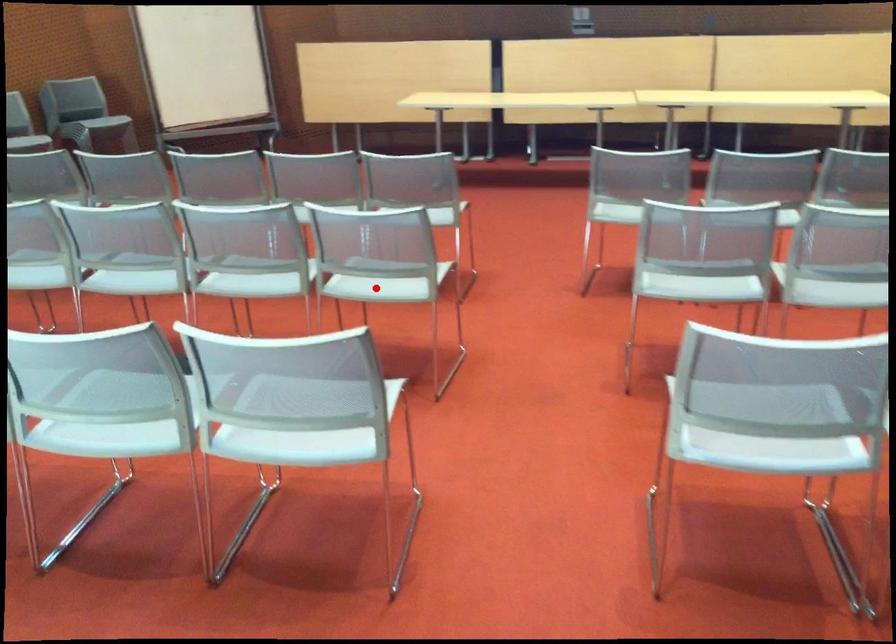
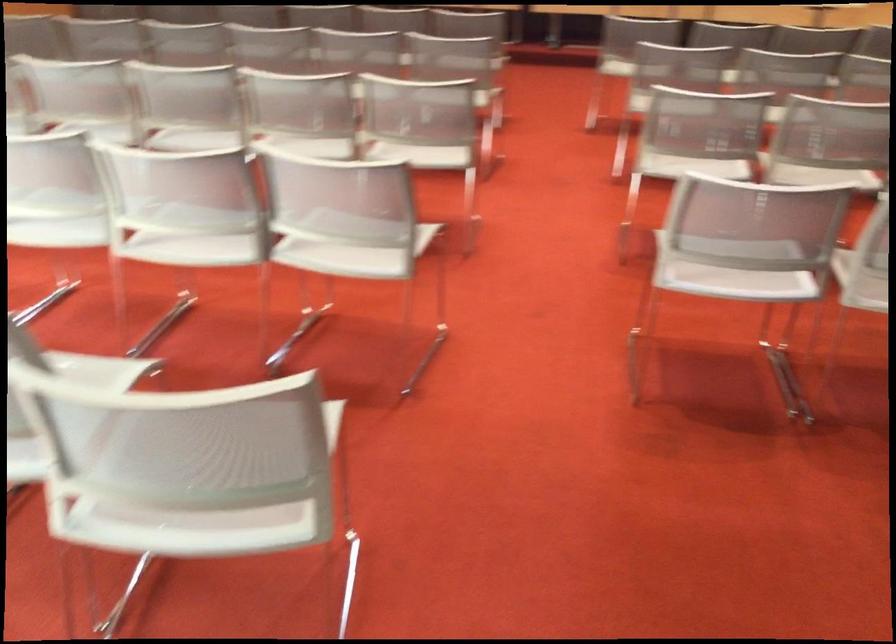
Question: I am providing you with two images of the same scene from different viewpoints. A red point is marked on the first image. Is the red point's position out of view in image 2?

Choices:
 (A) Yes
 (B) No

Answer: (A)